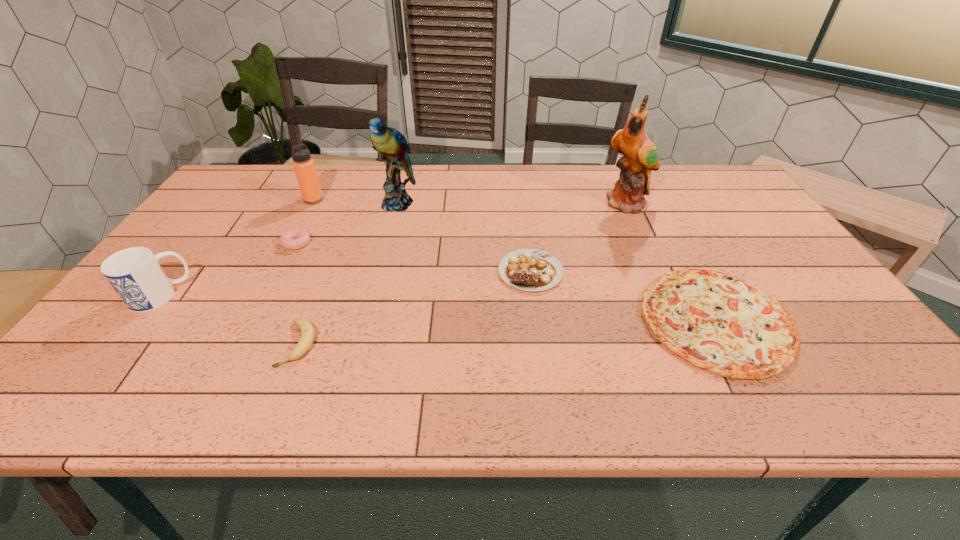
The image size is (960, 540). What are the coordinates of `free region that satisfies the following two spatial constraints: 1. on the front side of the shortest object; 2. on the right side of the third tallest object` in the screenshot? It's located at (252, 320).